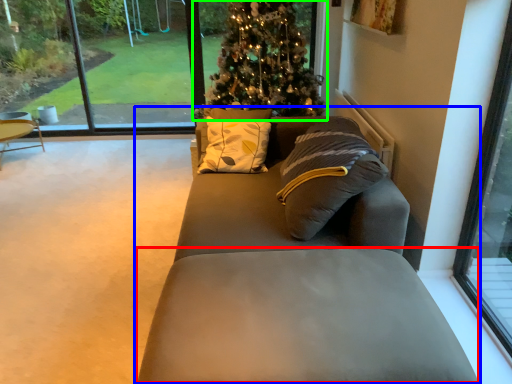
Question: Based on their relative distances, which object is nearer to footrest (highlighted by a red box)? Choose from studio couch (highlighted by a blue box) and christmas tree (highlighted by a green box).

Choices:
 (A) studio couch
 (B) christmas tree

Answer: (A)